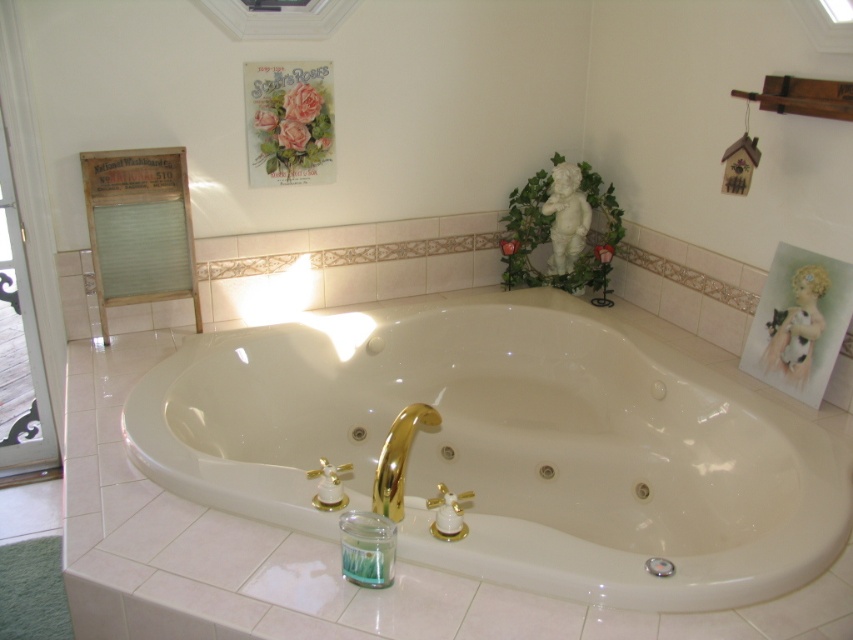
Question: Which of the following is the farthest from the observer?

Choices:
 (A) (1, 120)
 (B) (720, 397)

Answer: (A)

Question: Can you confirm if white glossy bathtub at center is positioned below clear glass screen door at left?

Choices:
 (A) yes
 (B) no

Answer: (A)

Question: Can you confirm if white glossy bathtub at center is positioned above clear glass screen door at left?

Choices:
 (A) yes
 (B) no

Answer: (B)

Question: In this image, where is white glossy bathtub at center located relative to clear glass screen door at left?

Choices:
 (A) above
 (B) below

Answer: (B)